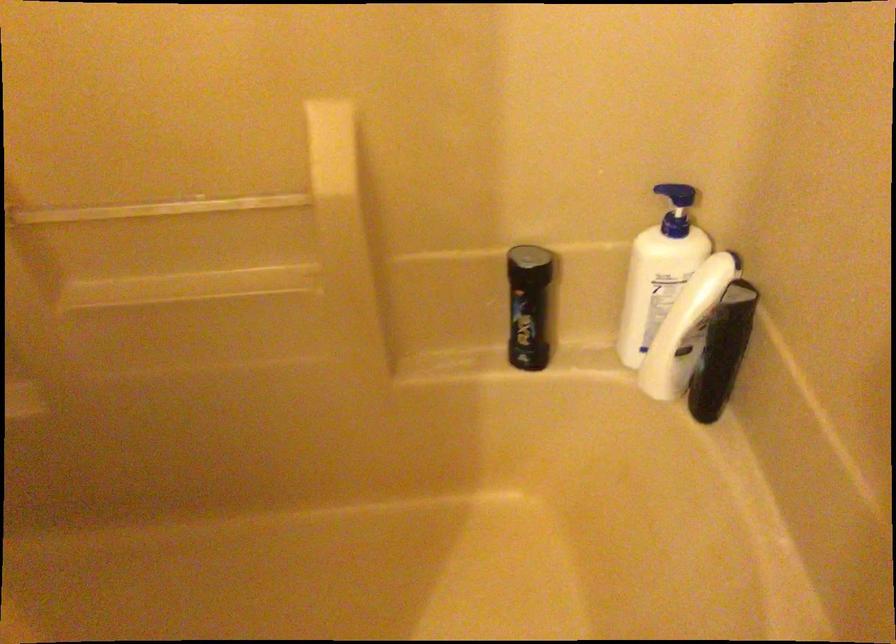
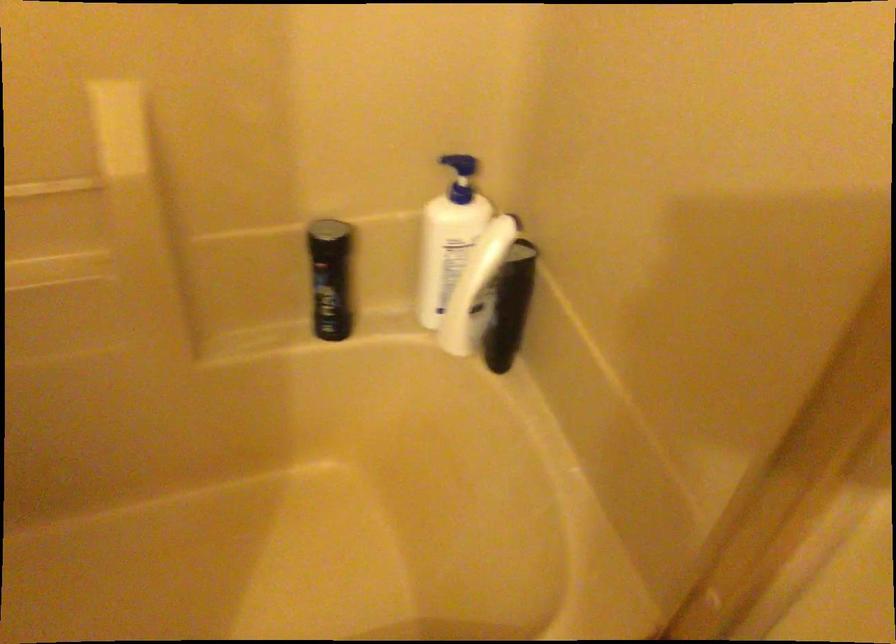
Locate, in the second image, the point that corresponds to (659,275) in the first image.

(451, 242)